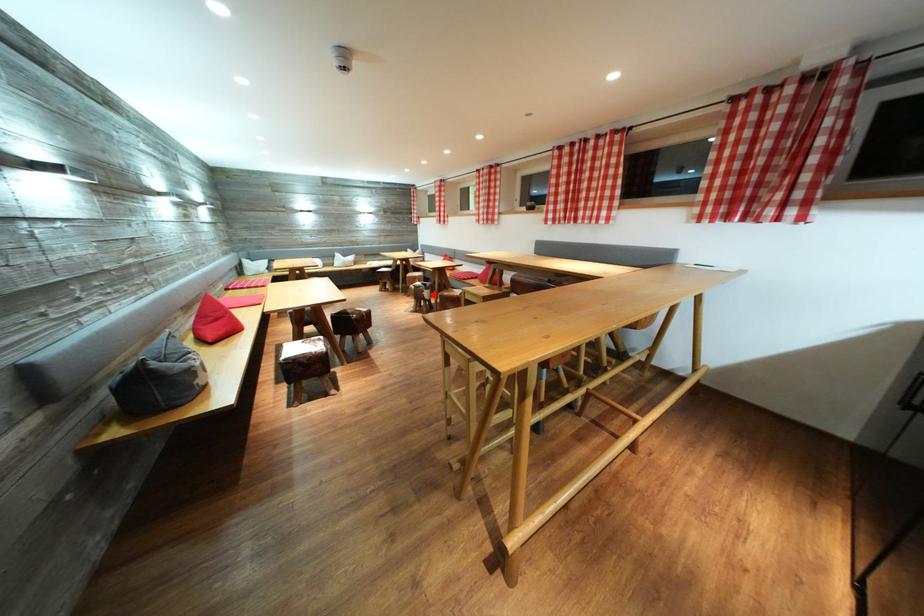
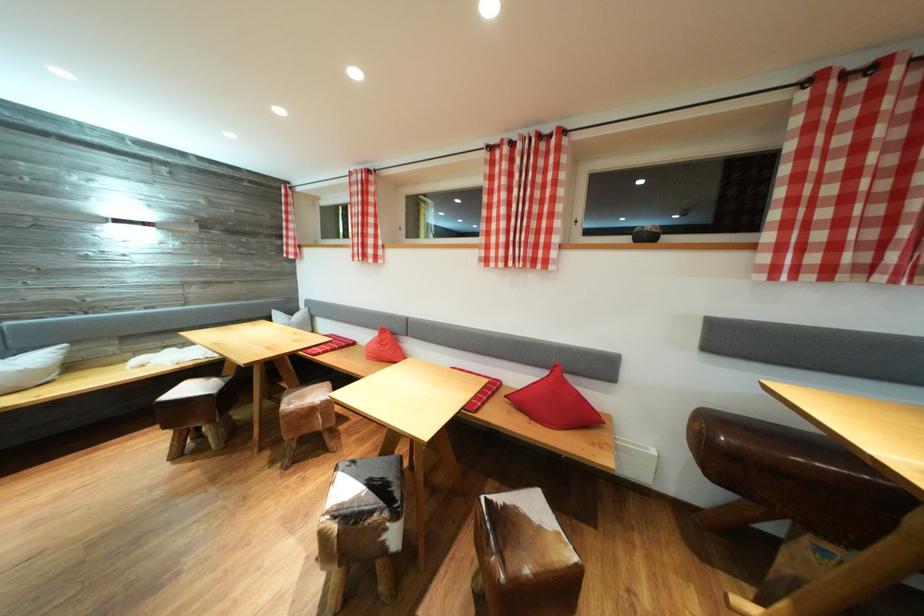
Question: I am providing you with two images of the same scene from different viewpoints. In image1, a red point is highlighted. Considering the same 3D point in image2, which of the following is correct?

Choices:
 (A) It is closer
 (B) It is farther

Answer: (B)